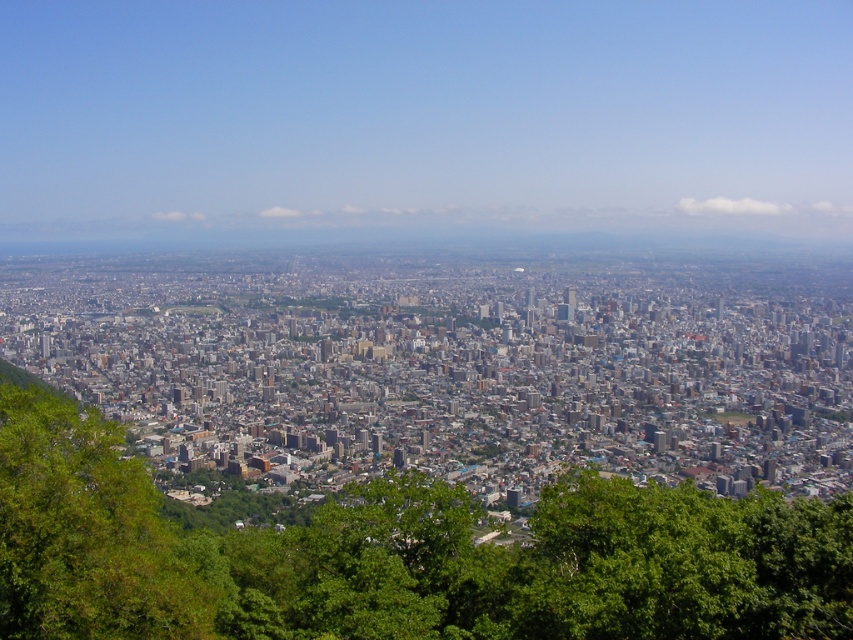
Question: Where is green leafy tree at center located in relation to green leafy tree at lower left in the image?

Choices:
 (A) left
 (B) right

Answer: (B)

Question: Can you confirm if green leafy tree at center is smaller than green leafy tree at lower left?

Choices:
 (A) no
 (B) yes

Answer: (A)

Question: Which point is closer to the camera?

Choices:
 (A) green leafy tree at lower left
 (B) green leafy tree at center

Answer: (B)

Question: Which object appears closest to the camera in this image?

Choices:
 (A) green leafy tree at lower left
 (B) green leafy tree at center

Answer: (B)

Question: Is green leafy tree at center in front of green leafy tree at lower left?

Choices:
 (A) no
 (B) yes

Answer: (B)

Question: Which point is closer to the camera?

Choices:
 (A) (4, 468)
 (B) (699, 536)

Answer: (A)